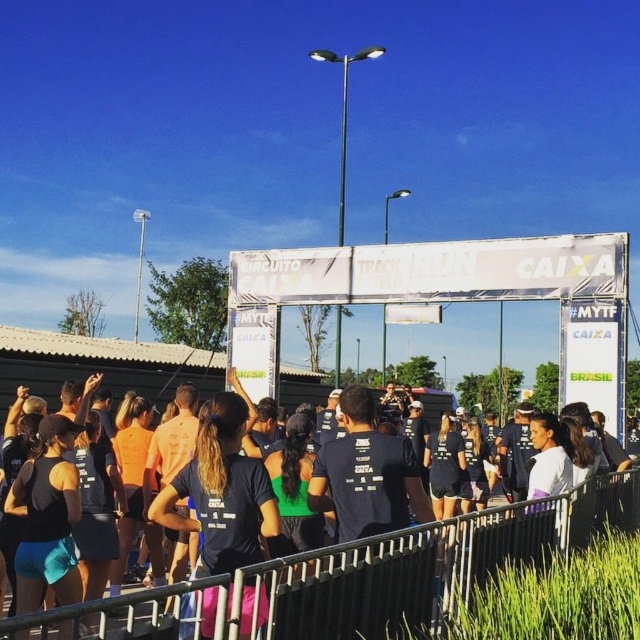
Who is positioned more to the left, metallic silver fence at center or black matte t-shirt at center?

Positioned to the left is black matte t-shirt at center.

This screenshot has height=640, width=640. I want to click on metallic silver fence at center, so click(x=378, y=572).

The width and height of the screenshot is (640, 640). What do you see at coordinates (378, 572) in the screenshot? I see `metallic silver fence at center` at bounding box center [378, 572].

Find the location of a particular element. The width and height of the screenshot is (640, 640). metallic silver fence at center is located at coordinates (378, 572).